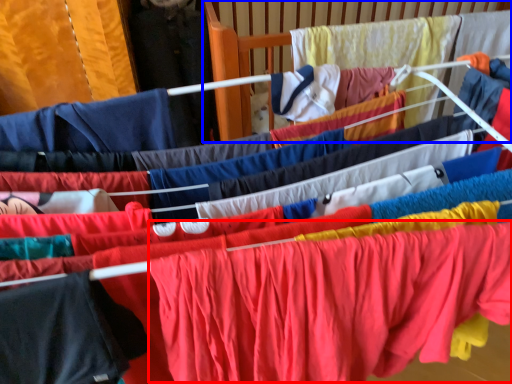
Question: Which object is further to the camera taking this photo, clothing (highlighted by a red box) or infant bed (highlighted by a blue box)?

Choices:
 (A) clothing
 (B) infant bed

Answer: (B)